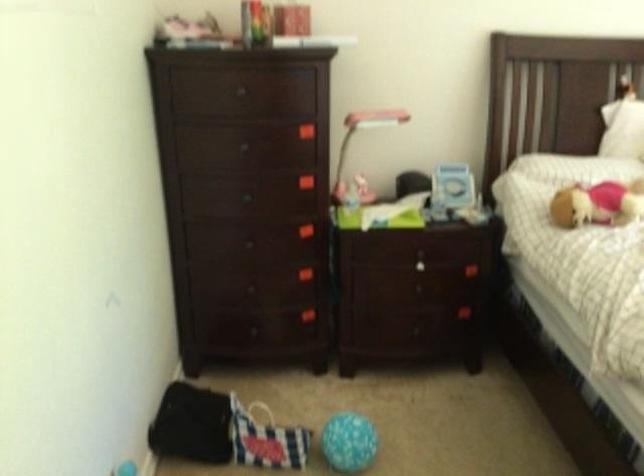
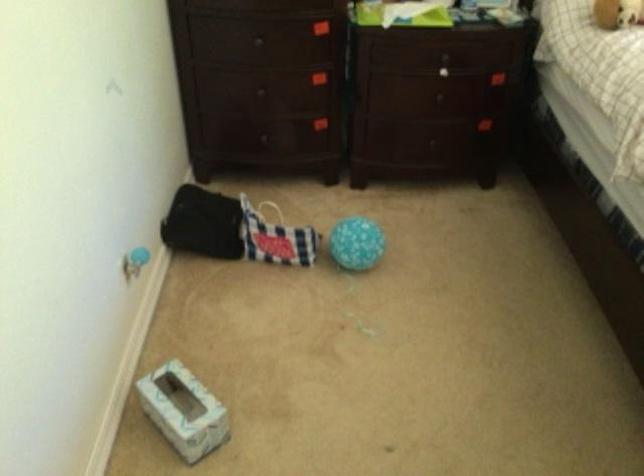
Locate, in the second image, the point that corresponds to point (245, 247) in the first image.

(260, 44)